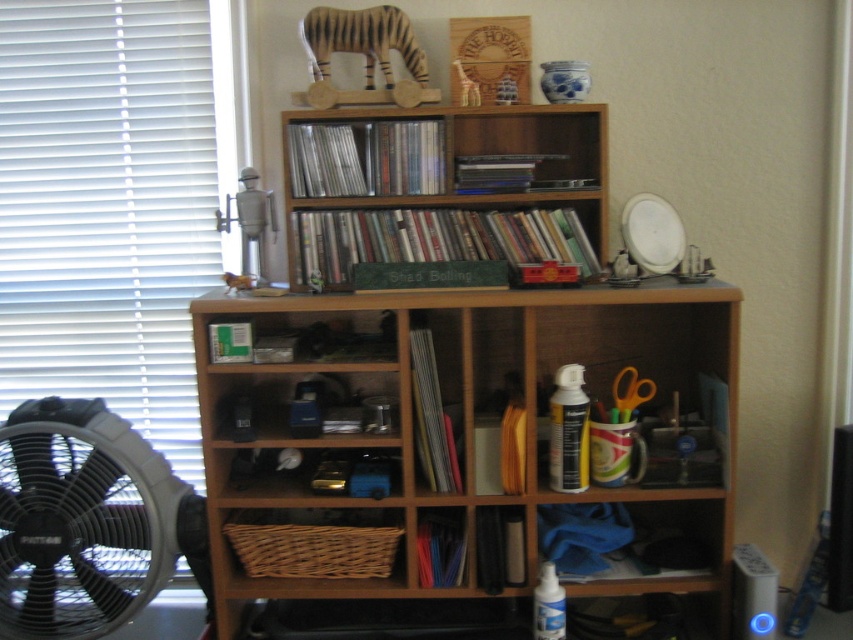
Looking at this image, does wooden bookcase at center have a greater width compared to wooden bookshelf at center?

Yes.

Is point (641, 518) less distant than point (310, 230)?

No.

At what (x,y) coordinates should I click in order to perform the action: click on wooden bookcase at center. Please return your answer as a coordinate pair (x, y). This screenshot has height=640, width=853. Looking at the image, I should click on (463, 429).

How far apart are metallic robot at upper center and orange plastic scissors at center?

29.43 inches

Is metallic robot at upper center positioned at the back of orange plastic scissors at center?

Yes, metallic robot at upper center is behind orange plastic scissors at center.

Is point (253, 234) more distant than point (648, 397)?

Yes, it is behind point (648, 397).

You are a GUI agent. You are given a task and a screenshot of the screen. Output one action in this format:
    pyautogui.click(x=<x>, y=<y>)
    Task: Click on the metallic robot at upper center
    
    Given the screenshot: What is the action you would take?
    pyautogui.click(x=248, y=221)

Is wooden bookshelf at center above metallic robot at upper center?

Yes.

Can you confirm if wooden bookshelf at center is smaller than metallic robot at upper center?

Incorrect, wooden bookshelf at center is not smaller in size than metallic robot at upper center.

Is point (318, 145) positioned before point (253, 218)?

That is True.

Where is `wooden bookshelf at center`? wooden bookshelf at center is located at coordinates (445, 188).